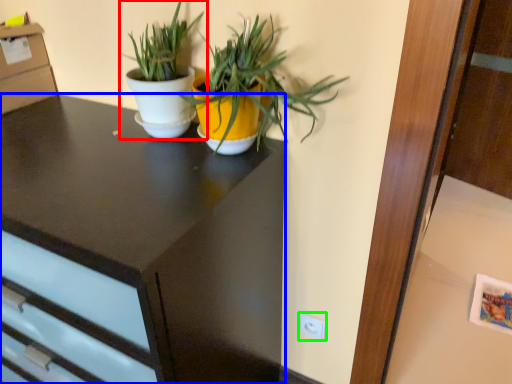
Question: Which is nearer to the houseplant (highlighted by a red box)? desk (highlighted by a blue box) or electric outlet (highlighted by a green box).

Choices:
 (A) desk
 (B) electric outlet

Answer: (A)